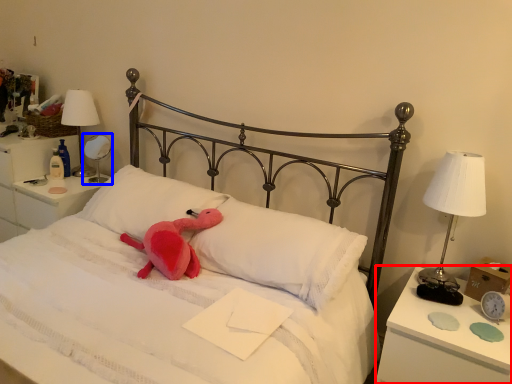
Question: Which object appears farthest to the camera in this image, nightstand (highlighted by a red box) or bedside lamp (highlighted by a blue box)?

Choices:
 (A) nightstand
 (B) bedside lamp

Answer: (B)